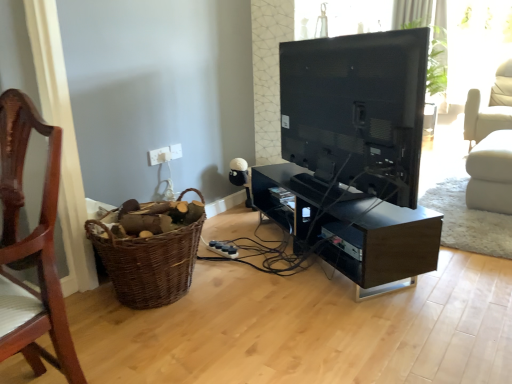
Question: Do you think matte black tv at center is within white plastic electric outlet at upper center, marked as the first electric outlet in a right-to-left arrangement, or outside of it?

Choices:
 (A) inside
 (B) outside

Answer: (B)

Question: Is matte black tv at center to the left or to the right of white plastic electric outlet at upper center, marked as the first electric outlet in a right-to-left arrangement, in the image?

Choices:
 (A) left
 (B) right

Answer: (B)

Question: Which object is positioned closest to the black glossy tv stand at center?

Choices:
 (A) brown woven basket at lower left
 (B) white plastic electric outlet at lower center, the first electric outlet in the left-to-right sequence
 (C) white plastic electric outlet at upper center, arranged as the 2th electric outlet when viewed from the left
 (D) white fabric swivel chair at right
 (E) wooden chair at left

Answer: (A)

Question: Which of these objects is positioned farthest from the brown woven basket at lower left?

Choices:
 (A) white fabric swivel chair at right
 (B) white plastic electric outlet at upper center, marked as the first electric outlet in a right-to-left arrangement
 (C) black glossy tv stand at center
 (D) matte black tv at center
 (E) wooden chair at left

Answer: (A)